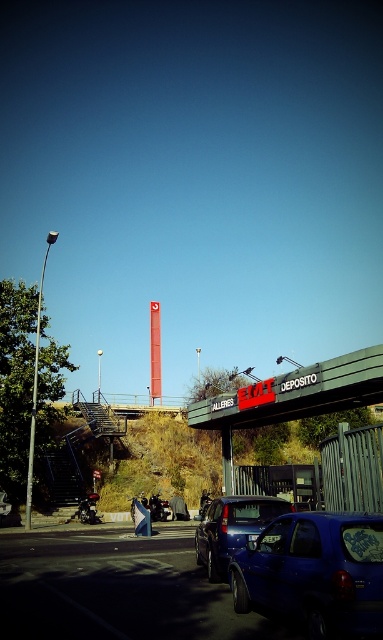
Question: Which object appears farthest from the camera in this image?

Choices:
 (A) glossy blue car at lower right
 (B) smooth glass tower at center
 (C) silver metallic pole at left
 (D) metallic blue sedan at center

Answer: (B)

Question: Does glossy blue car at lower right have a greater width compared to metallic blue sedan at center?

Choices:
 (A) yes
 (B) no

Answer: (B)

Question: Which point is farther from the camera taking this photo?

Choices:
 (A) (361, 573)
 (B) (37, 326)
 (C) (155, 374)
 (D) (271, 497)

Answer: (C)

Question: Which object is positioned farthest from the smooth glass tower at center?

Choices:
 (A) silver metallic pole at left
 (B) metallic blue sedan at center
 (C) glossy blue car at lower right

Answer: (B)

Question: Can you confirm if glossy blue car at lower right is positioned to the left of smooth glass tower at center?

Choices:
 (A) yes
 (B) no

Answer: (B)

Question: Can you confirm if glossy blue car at lower right is positioned above metallic blue sedan at center?

Choices:
 (A) yes
 (B) no

Answer: (A)